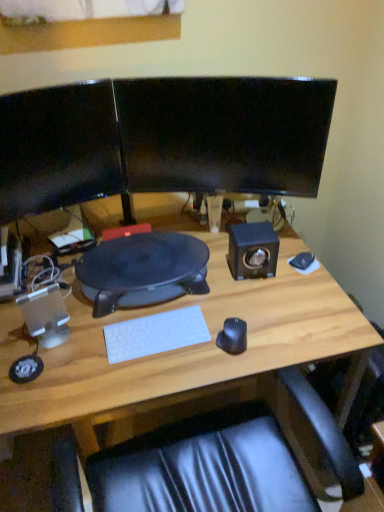
Identify the location of free space that is in between black matte mouse at center and white matte keyboard at center. The width and height of the screenshot is (384, 512). (189, 349).